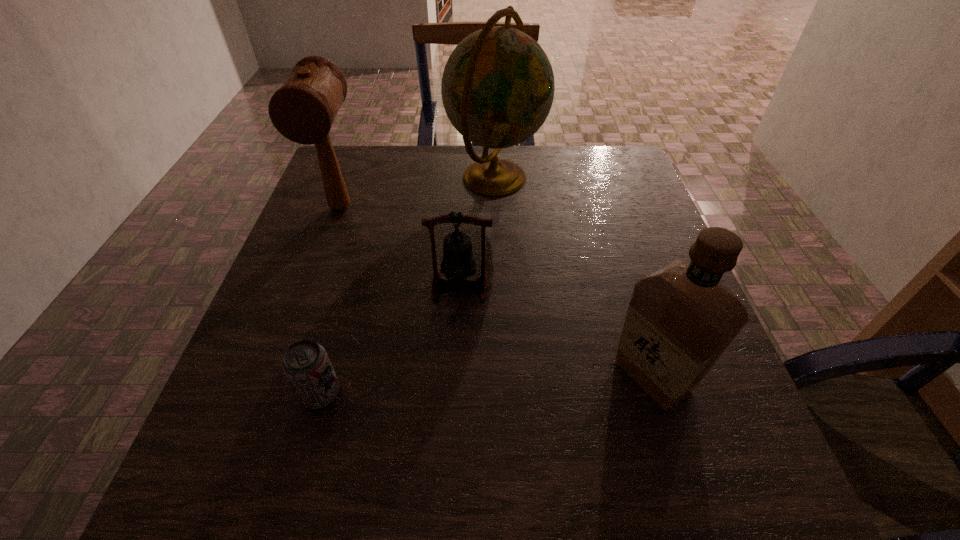
You are a GUI agent. You are given a task and a screenshot of the screen. Output one action in this format:
    pyautogui.click(x=<x>, y=<y>)
    Task: Click on the vacant space located on the front-facing side of the rightmost object
    
    Given the screenshot: What is the action you would take?
    pyautogui.click(x=429, y=376)

The image size is (960, 540). I want to click on free spot located on the left of the bell, so click(x=280, y=286).

Locate an element on the screen. The width and height of the screenshot is (960, 540). vacant space located on the right of the shortest object is located at coordinates (484, 394).

You are a GUI agent. You are given a task and a screenshot of the screen. Output one action in this format:
    pyautogui.click(x=<x>, y=<y>)
    Task: Click on the globe positioned at the far edge
    The width and height of the screenshot is (960, 540).
    Given the screenshot: What is the action you would take?
    pyautogui.click(x=497, y=89)

You are a GUI agent. You are given a task and a screenshot of the screen. Output one action in this format:
    pyautogui.click(x=<x>, y=<y>)
    Task: Click on the mallet that is at the far edge
    
    Given the screenshot: What is the action you would take?
    tap(303, 109)

The height and width of the screenshot is (540, 960). I want to click on mallet that is at the left edge, so click(303, 109).

Where is `beer can that is at the left edge`? The height and width of the screenshot is (540, 960). beer can that is at the left edge is located at coordinates (306, 364).

The height and width of the screenshot is (540, 960). Find the location of `object present at the right edge`. object present at the right edge is located at coordinates (681, 318).

Locate an element on the screen. This screenshot has width=960, height=540. object present at the far left corner is located at coordinates (303, 109).

This screenshot has width=960, height=540. I want to click on free region at the far edge of the desktop, so click(543, 151).